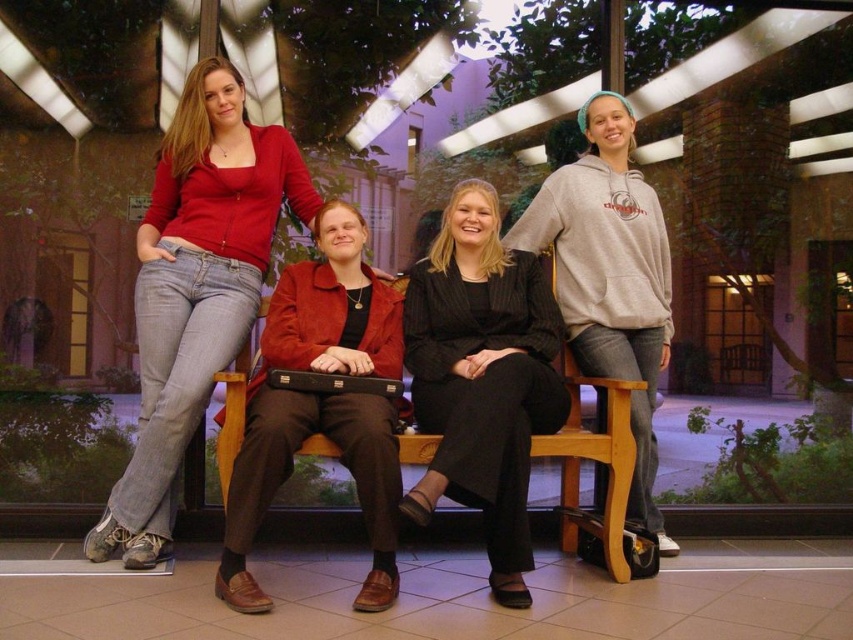
You are organizing a meeting in the indoor space and need to place a document on the wooden bench at center so that it is visible to everyone. Where should you place the document relative to the matte black briefcase at center to ensure it is in the middle of the bench?

Place the document to the right of the matte black briefcase at center so that it is in the middle of the wooden bench at center.

You are a delivery person who needs to place a package on the wooden bench at center. The package is 5 feet long. Can you fit the package on the bench without overlapping the matte black briefcase at center?

The distance between the matte black briefcase at center and the wooden bench at center is 4.98 feet. Since the package is 5 feet long, it will slightly overlap the matte black briefcase at center when placed on the bench.